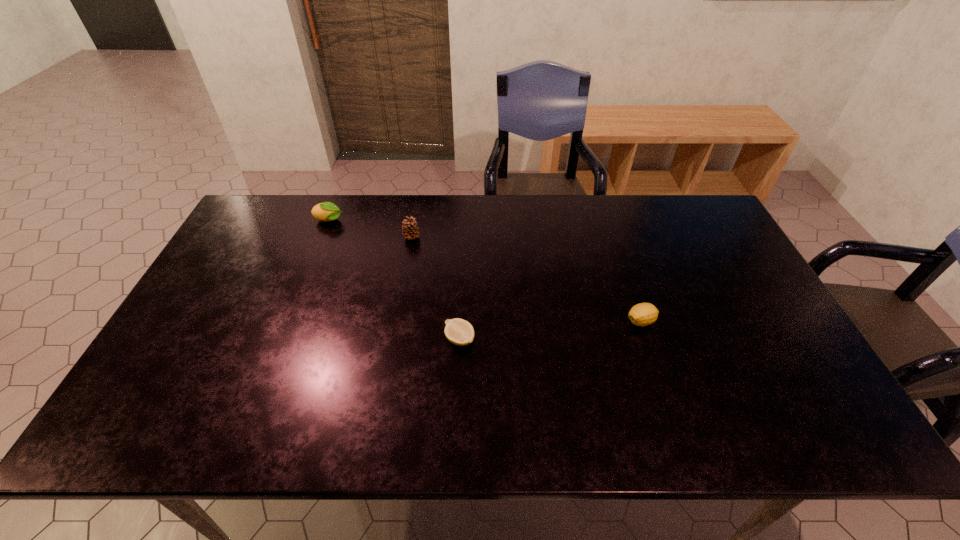
Locate an element on the screen. the tallest object is located at coordinates (410, 230).

Where is `pinecone`? pinecone is located at coordinates (410, 230).

Where is `the tallest lemon`? The width and height of the screenshot is (960, 540). the tallest lemon is located at coordinates (326, 211).

You are a GUI agent. You are given a task and a screenshot of the screen. Output one action in this format:
    pyautogui.click(x=<x>, y=<y>)
    Task: Click on the second tallest object
    Image resolution: width=960 pixels, height=540 pixels.
    Given the screenshot: What is the action you would take?
    pyautogui.click(x=326, y=211)

Where is `the rightmost object`? Image resolution: width=960 pixels, height=540 pixels. the rightmost object is located at coordinates (643, 314).

At what (x,y) coordinates should I click in order to perform the action: click on the second tallest lemon. Please return your answer as a coordinate pair (x, y). The width and height of the screenshot is (960, 540). Looking at the image, I should click on (643, 314).

Locate an element on the screen. This screenshot has width=960, height=540. the shortest lemon is located at coordinates (460, 332).

Image resolution: width=960 pixels, height=540 pixels. What are the coordinates of `the second object from right to left` in the screenshot? It's located at (460, 332).

I want to click on free space located 0.100m on the left of the pinecone, so click(x=372, y=237).

I want to click on vacant region located 0.350m with leaves positioned above the tallest lemon, so click(447, 221).